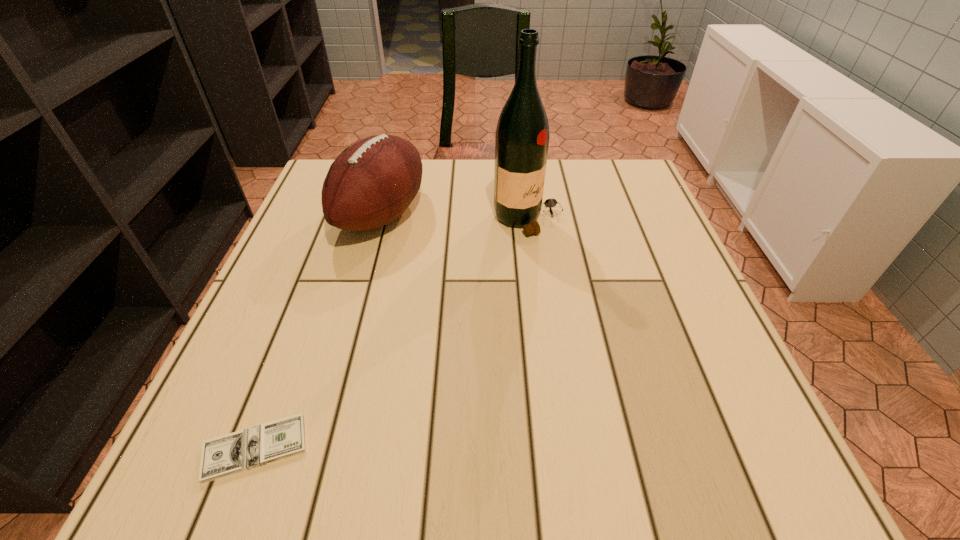
The height and width of the screenshot is (540, 960). In order to click on object at the near edge in this screenshot , I will do click(229, 454).

Where is `football (American) situated at the left edge`? football (American) situated at the left edge is located at coordinates (371, 183).

This screenshot has height=540, width=960. Find the location of `dollar that is at the left edge`. dollar that is at the left edge is located at coordinates (229, 454).

At what (x,y) coordinates should I click in order to perform the action: click on object present at the far left corner. Please return your answer as a coordinate pair (x, y). This screenshot has width=960, height=540. Looking at the image, I should click on (371, 183).

Image resolution: width=960 pixels, height=540 pixels. Find the location of `object located at the near left corner`. object located at the near left corner is located at coordinates [x=229, y=454].

Where is `free space at the far edge of the desktop`? The height and width of the screenshot is (540, 960). free space at the far edge of the desktop is located at coordinates (452, 190).

This screenshot has width=960, height=540. I want to click on blank area at the near edge, so click(x=612, y=454).

The height and width of the screenshot is (540, 960). Identify the location of vacant space at the left edge of the desktop. (304, 230).

Where is `free space at the right edge`? free space at the right edge is located at coordinates (598, 222).

The width and height of the screenshot is (960, 540). Identify the location of vacant region at the far right corner. (636, 200).